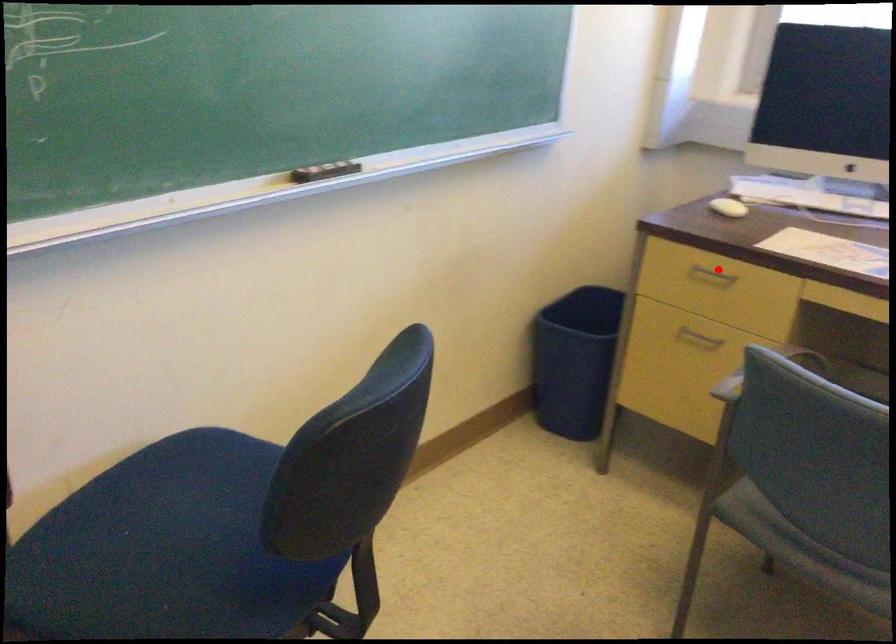
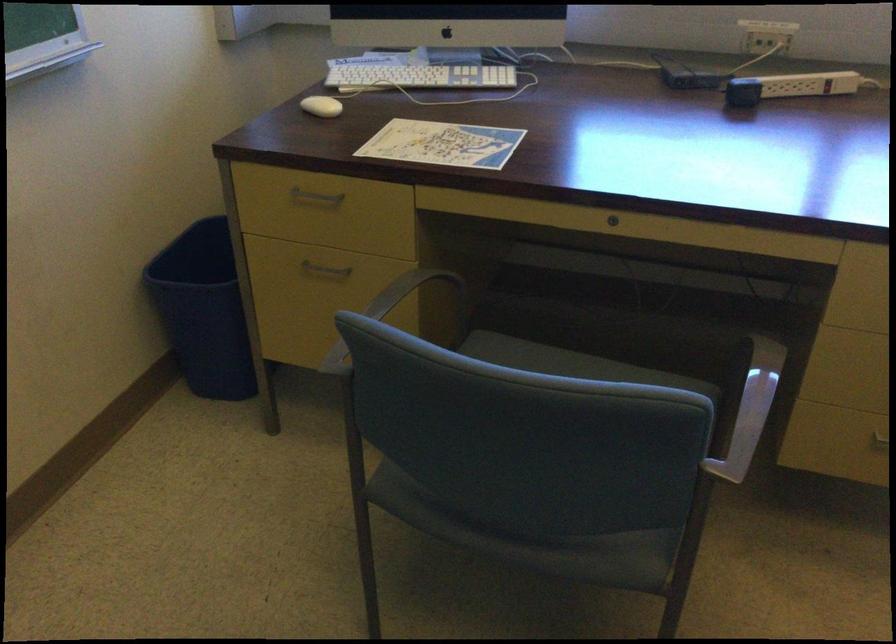
Question: I am providing you with two images of the same scene from different viewpoints. In image1, a red point is highlighted. Considering the same 3D point in image2, which of the following is correct?

Choices:
 (A) It is closer
 (B) It is farther

Answer: (A)